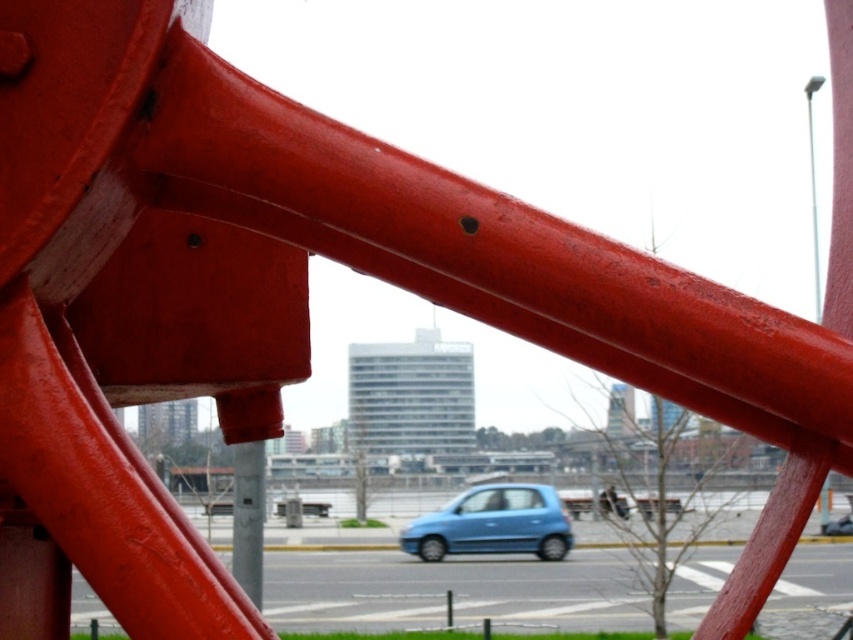
Question: Which point is closer to the camera taking this photo?

Choices:
 (A) (556, 556)
 (B) (251, 572)

Answer: (B)

Question: Can you confirm if matte blue car at center is wider than metallic gray pole at center?

Choices:
 (A) no
 (B) yes

Answer: (B)

Question: Does matte blue car at center have a lesser width compared to metallic gray pole at center?

Choices:
 (A) yes
 (B) no

Answer: (B)

Question: Is matte blue car at center smaller than metallic gray pole at center?

Choices:
 (A) yes
 (B) no

Answer: (B)